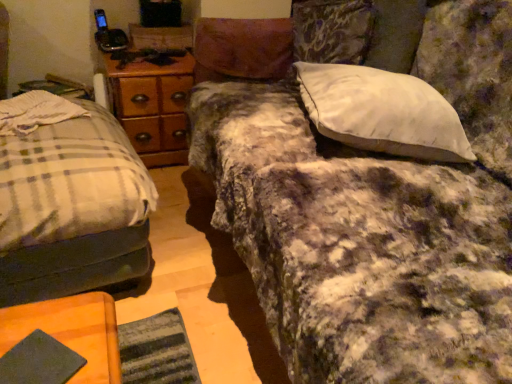
Question: Considering the positions of white soft pillow at upper right and fluffy purple blanket at center in the image, is white soft pillow at upper right wider or thinner than fluffy purple blanket at center?

Choices:
 (A) thin
 (B) wide

Answer: (A)

Question: In terms of height, does white soft pillow at upper right look taller or shorter compared to fluffy purple blanket at center?

Choices:
 (A) short
 (B) tall

Answer: (A)

Question: Which of these objects is positioned farthest from the white soft pillow at upper right?

Choices:
 (A) plaid fabric bed at left
 (B) wooden at left
 (C) dark green fabric at lower left
 (D) fluffy purple blanket at center

Answer: (B)

Question: Estimate the real-world distances between objects in this image. Which object is farther from the fluffy purple blanket at center?

Choices:
 (A) dark green fabric at lower left
 (B) wooden at left
 (C) plaid fabric bed at left
 (D) white soft pillow at upper right

Answer: (B)